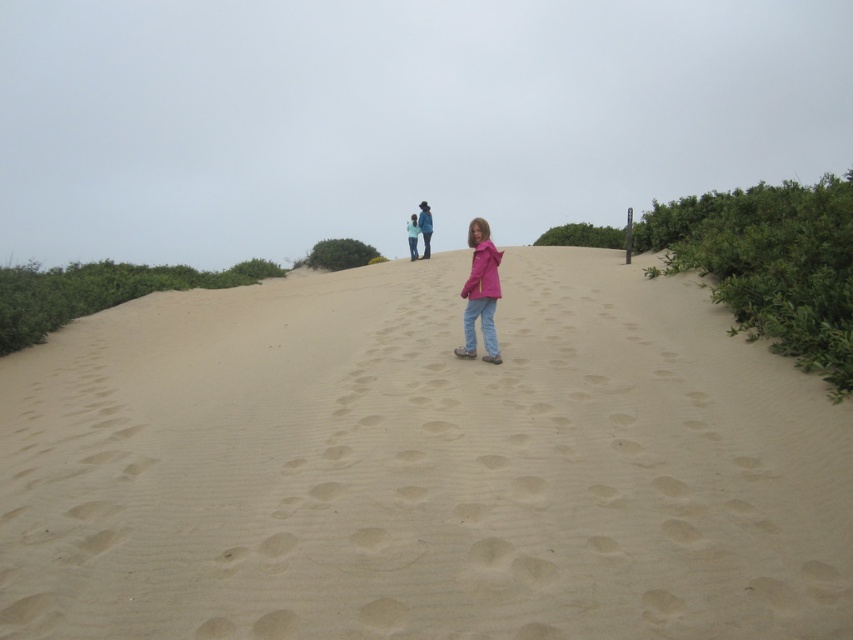
You are standing on the sandy dune and see the smooth sand at center and the blue denim jacket at center. Which object is positioned to the left of the other?

The smooth sand at center is to the left of the blue denim jacket at center.

In the scene shown: You are standing on the smooth sand at center. Looking at the coordinates provided, where exactly is the smooth sand located in the image?

The smooth sand at center is located at the 2D coordinates point of (421, 467).